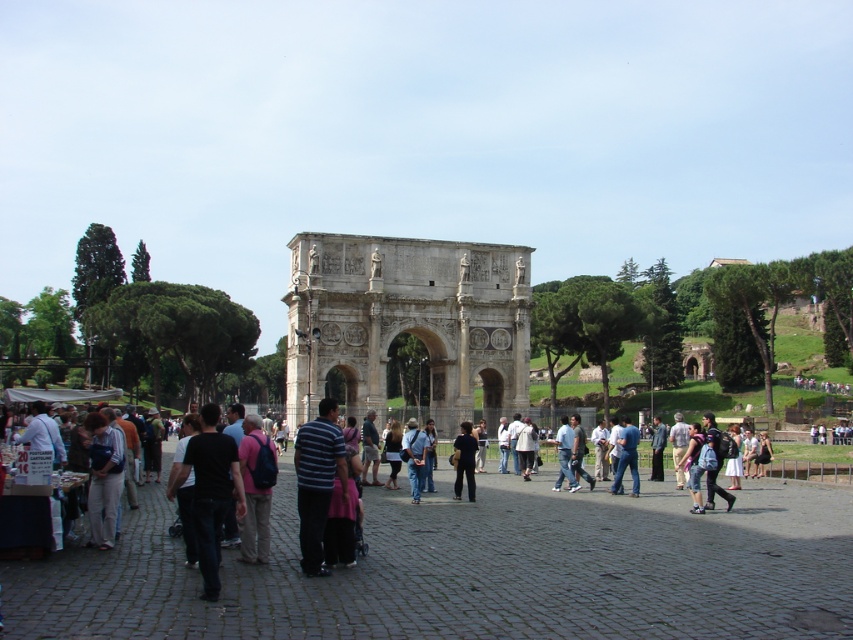
You are a tourist standing in the plaza in front of the light beige stone arch at center and the dark blue fabric shirt at center. Which object is positioned to the left from your perspective?

The light beige stone arch at center is to the left of the dark blue fabric shirt at center from the observer perspective.

You are standing in the plaza in front of the Arch of Constantine. A tour guide asks you to locate the exact center point of the light beige stone arch at center. Using the coordinate system where the bottom left corner of the image is the origin, can you determine if the center point of the light beige stone arch at center is at the point specified as point (407, 321)?

Yes, the light beige stone arch at center is located at point (407, 321) according to the provided coordinates.

You are a photographer standing in the plaza in front of the Arch of Constantine. You want to take a photo of both the blue jeans at center and the dark blue fabric shirt at center. Which object should you focus on first if you want to ensure both are in sharp focus?

You should focus on the blue jeans at center first because it is taller than the dark blue fabric shirt at center, so focusing on the farther object ensures both will be in focus.